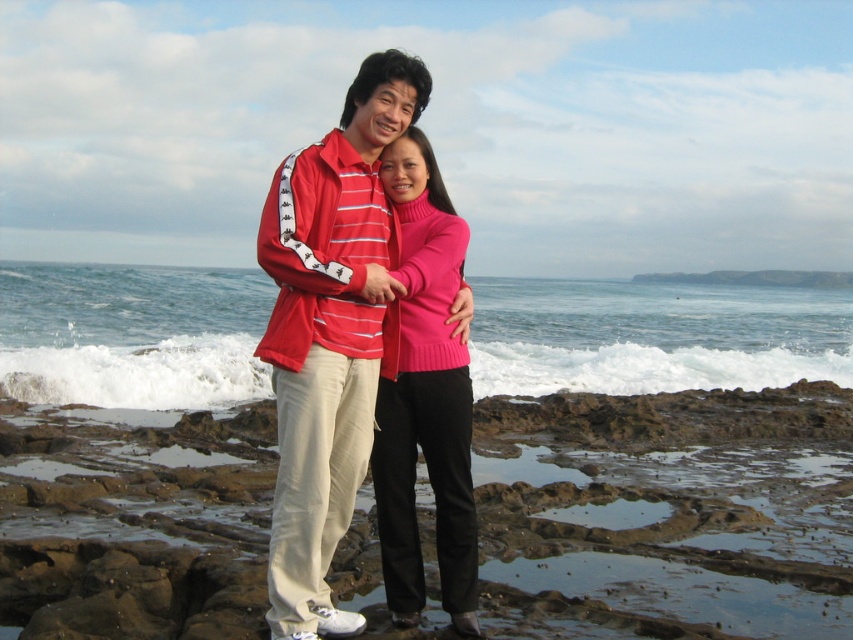
Consider the image. You are a photographer planning to take a group photo of the two people in the scene. You want to ensure that both the brown rocky coast at center and the matte pink sweater at center are clearly visible in the photo. Given their distance apart, what is the minimum focal length you should use to capture both subjects without distortion?

The brown rocky coast at center and the matte pink sweater at center are 3.59 meters apart. To capture both subjects without distortion, you should use a focal length of at least 50mm, as this focal length provides a natural perspective for group shots while maintaining clarity and minimizing distortion over such a distance.

You are a photographer trying to capture a portrait of both the matte red jacket at center and the matte pink sweater at center. Since you want to ensure both subjects are fully visible in the frame, which subject should you position closer to the camera to maintain their visibility?

The matte red jacket at center is much taller than the matte pink sweater at center. To ensure both are fully visible, position the matte red jacket at center closer to the camera so its height doesn

You are a photographer trying to capture a candid shot of the two people in the scene. Since you want to focus on the person in the matte red jacket at center, which part of the matte pink sweater at center might block your view?

The matte red jacket at center is in front of the matte pink sweater at center, so the matte pink sweater at center would be partially hidden behind the matte red jacket at center. Therefore, the matte pink sweater at center might block your view of the back of the matte red jacket at center.